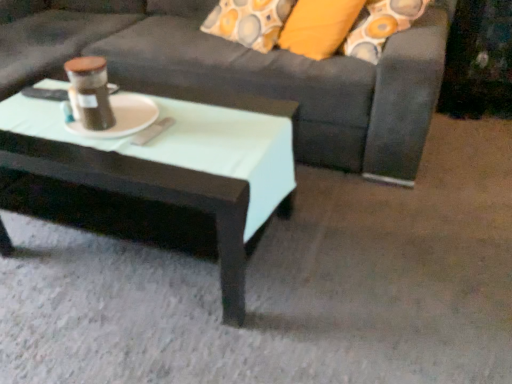
Identify the location of vacant region in front of matte brown jar at center. (106, 150).